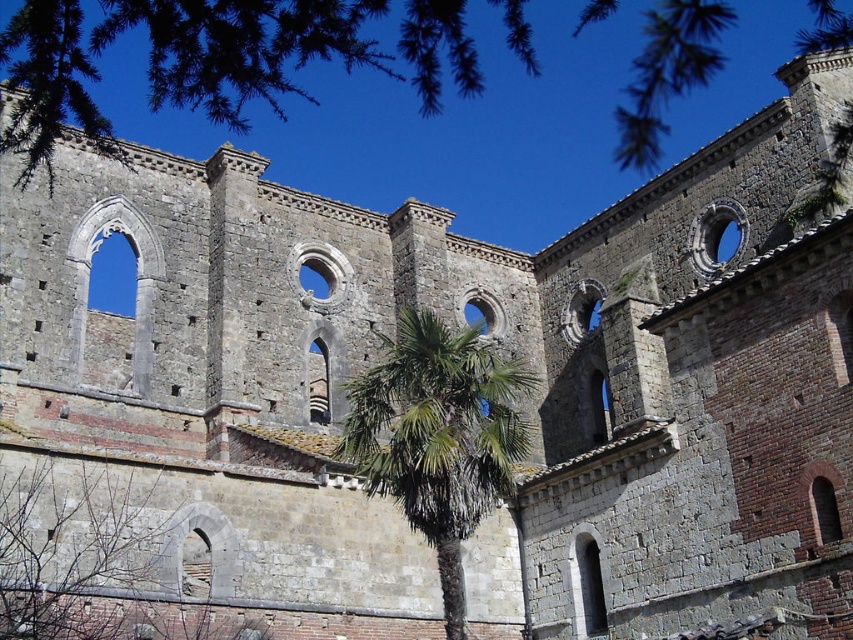
You are standing at the center of the ancient stone building ruins. You want to take a photo of the green leafy palm at center. Where should you position yourself to frame the palm in the center of your photo?

The green leafy palm at center is located at point [438,435], so you should position yourself directly in front of that coordinate to frame it in the center of your photo.

You are standing at the point labeled as point (x=219, y=54) in the image. What can you see directly in front of you?

You can see the green leafy tree at upper center directly in front of you because the point (x=219, y=54) indicates its location.